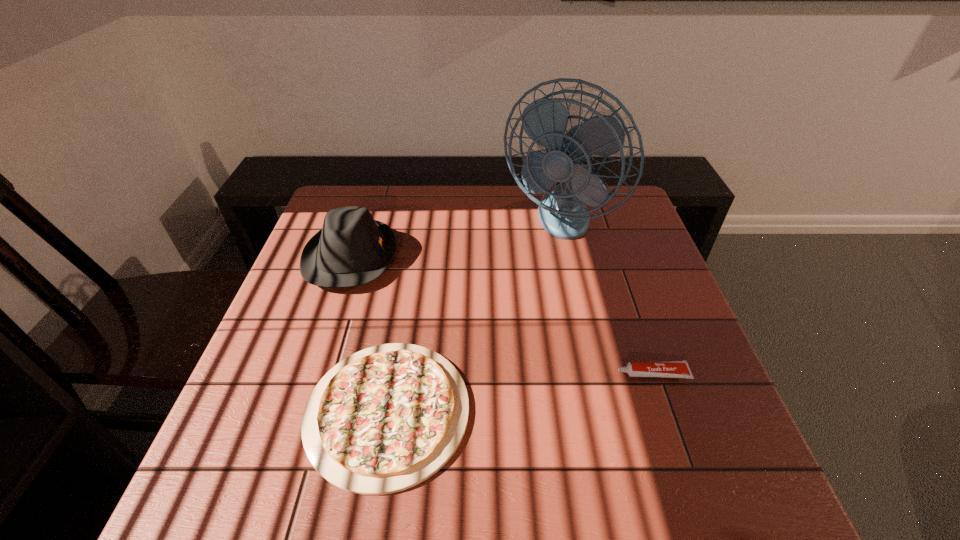
Identify the location of empty space that is in between the fan and the third shortest object. (453, 240).

Identify the location of vacant area that lies between the toothpaste and the third shortest object. The width and height of the screenshot is (960, 540). (502, 315).

You are a GUI agent. You are given a task and a screenshot of the screen. Output one action in this format:
    pyautogui.click(x=<x>, y=<y>)
    Task: Click on the free spot between the fedora and the toothpaste
    Image resolution: width=960 pixels, height=540 pixels.
    Given the screenshot: What is the action you would take?
    pyautogui.click(x=502, y=315)

You are a GUI agent. You are given a task and a screenshot of the screen. Output one action in this format:
    pyautogui.click(x=<x>, y=<y>)
    Task: Click on the vacant area that lies between the pizza and the tallest object
    The height and width of the screenshot is (540, 960).
    Given the screenshot: What is the action you would take?
    (x=471, y=318)

Image resolution: width=960 pixels, height=540 pixels. Identify the location of vacant region between the toothpaste and the pizza. (520, 392).

Where is `object that is the closest to the pizza`? The image size is (960, 540). object that is the closest to the pizza is located at coordinates (352, 249).

Select which object appears as the second closest to the toothpaste. Please provide its 2D coordinates. Your answer should be formatted as a tuple, i.e. [(x, y)], where the tuple contains the x and y coordinates of a point satisfying the conditions above.

[(562, 212)]

Image resolution: width=960 pixels, height=540 pixels. In order to click on vacant area in the image that satisfies the following two spatial constraints: 1. at the nozzle of the toothpaste; 2. on the front side of the pizza in this screenshot , I will do coord(665,411).

At what (x,y) coordinates should I click in order to perform the action: click on free point that satisfies the following two spatial constraints: 1. on the front-facing side of the fedora; 2. on the left side of the pizza. Please return your answer as a coordinate pair (x, y). Looking at the image, I should click on tap(300, 411).

Identify the location of vacant space that satisfies the following two spatial constraints: 1. in front of the fan to blow air; 2. on the front-facing side of the third shortest object. (563, 257).